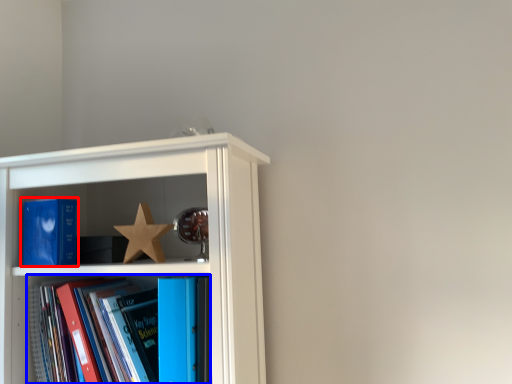
Question: Which object is closer to the camera taking this photo, book (highlighted by a red box) or book (highlighted by a blue box)?

Choices:
 (A) book
 (B) book

Answer: (B)